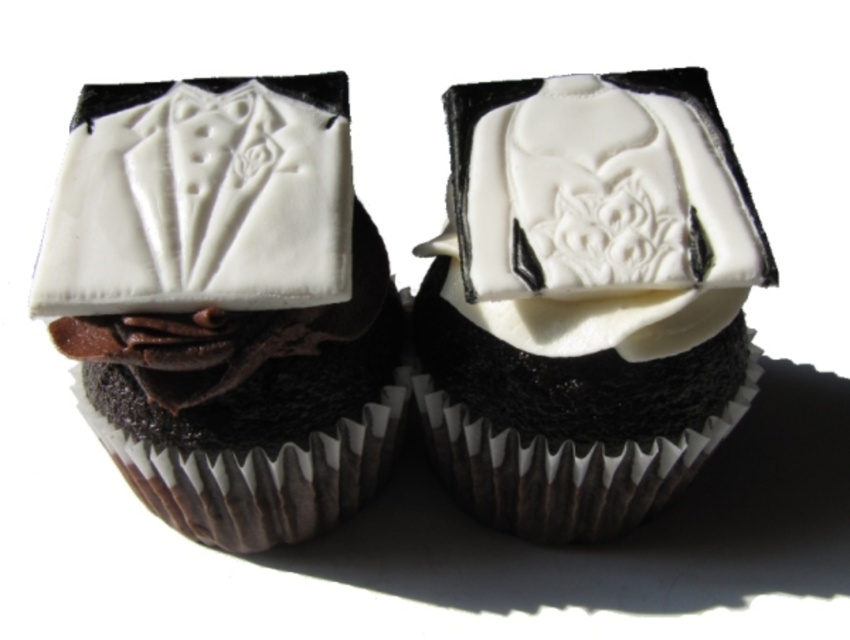
Between point (224, 346) and point (157, 189), which one is positioned in front?

Positioned in front is point (224, 346).

Which is in front, point (307, 381) or point (68, 176)?

Point (68, 176)

The image size is (850, 640). I want to click on white glossy fondant groom at center, so click(x=225, y=304).

Is the position of white glossy fondant at center less distant than that of white fondant tuxedo at center?

No, it is behind white fondant tuxedo at center.

Does white glossy fondant at center have a larger size compared to white fondant tuxedo at center?

Correct, white glossy fondant at center is larger in size than white fondant tuxedo at center.

The width and height of the screenshot is (850, 640). I want to click on white glossy fondant at center, so [x=585, y=298].

At what (x,y) coordinates should I click in order to perform the action: click on white glossy fondant at center. Please return your answer as a coordinate pair (x, y). This screenshot has height=640, width=850. Looking at the image, I should click on (585, 298).

Does white glossy fondant groom at center have a larger size compared to white glossy fondant at center?

Indeed, white glossy fondant groom at center has a larger size compared to white glossy fondant at center.

Can you confirm if white glossy fondant groom at center is positioned below white glossy fondant at center?

Yes, white glossy fondant groom at center is below white glossy fondant at center.

Is point (327, 497) positioned behind point (593, 372)?

Yes, it is.

The height and width of the screenshot is (640, 850). In order to click on white glossy fondant groom at center in this screenshot , I will do `click(225, 304)`.